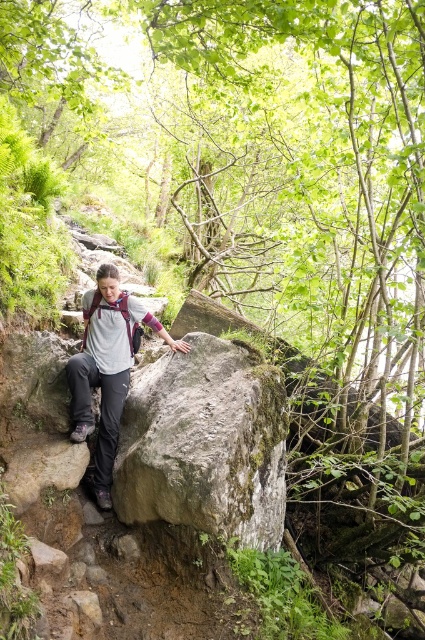
You are the hiker in the image and need to place your backpack on the ground before continuing. Given that the green mossy rock at center and the matte gray shirt at center are in your current view, where should you place your backpack to ensure it stays stable?

The green mossy rock at center is located below the matte gray shirt at center, so you should place your backpack on the green mossy rock at center since it provides a stable, lower surface compared to the matte gray shirt at center.

You are a hiker trying to cross the green mossy rock at center. The trail is narrow and rocky. If your backpack has a length of 1.5 meters, will you be able to step onto the rock without the backpack touching the ground behind you?

The green mossy rock at center is 12.56 feet away from the camera. Since 12.56 feet is approximately 3.83 meters, and your backpack is only 1.5 meters long, there is enough distance between you and the rock to ensure the backpack won not touch the ground behind you when stepping onto the rock.

You are a photographer trying to capture the hiker in the scene. You want to ensure that both the green mossy rock at center and the matte gray shirt at center are in focus. Given that your camera can only focus on objects within a 20 inch range, will both objects be in focus?

The green mossy rock at center and matte gray shirt at center are 22.65 inches apart. Since the distance between them exceeds the camera focus range of 20 inches, both objects cannot be in focus simultaneously.